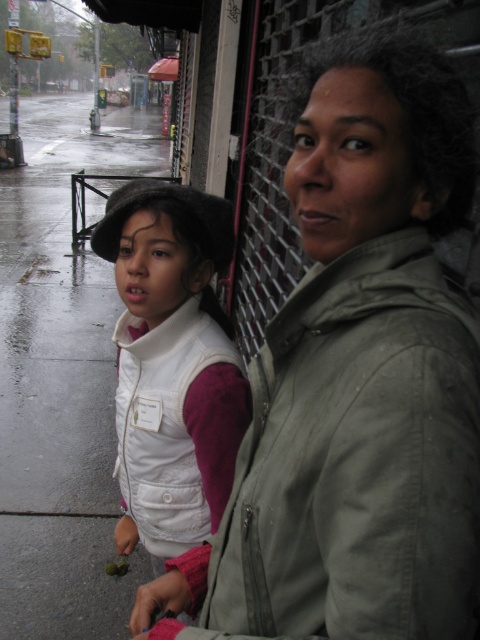
You are a delivery person who needs to locate the green matte jacket at center in the image. According to the coordinates provided, where exactly should you look?

The green matte jacket at center is located at point coordinates of (356, 461).

You are standing on the wet sidewalk and want to cross to the other side. Is the wet asphalt sidewalk at left the one you are currently standing on?

The wet asphalt sidewalk at left is located at point (x=60, y=380), so yes, you are standing on it.

You are a delivery drone trying to avoid obstacles. You need to fly over the green matte jacket at center. What are the coordinates where you should aim to drop the package?

The coordinates to drop the package are at point (356, 461), which is the location of the green matte jacket at center.